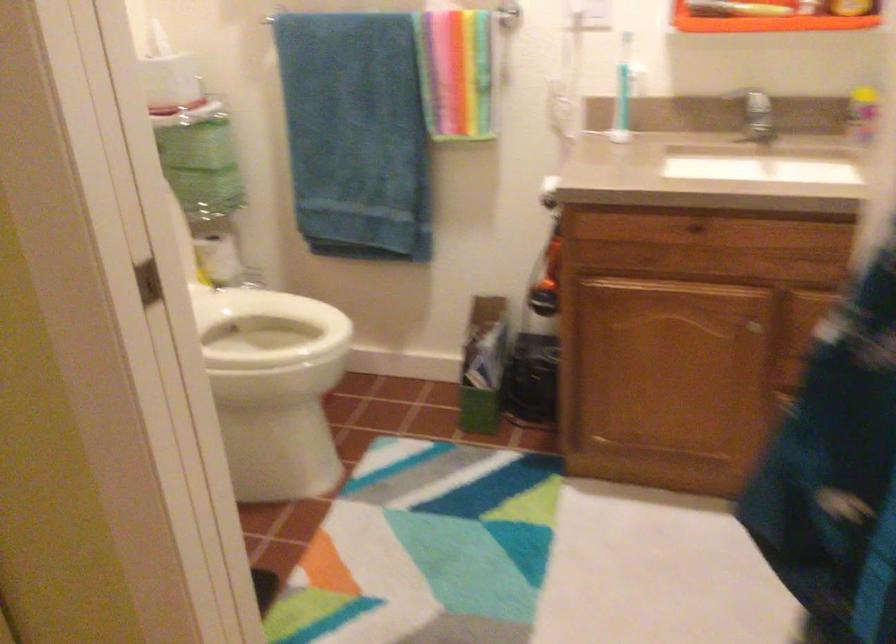
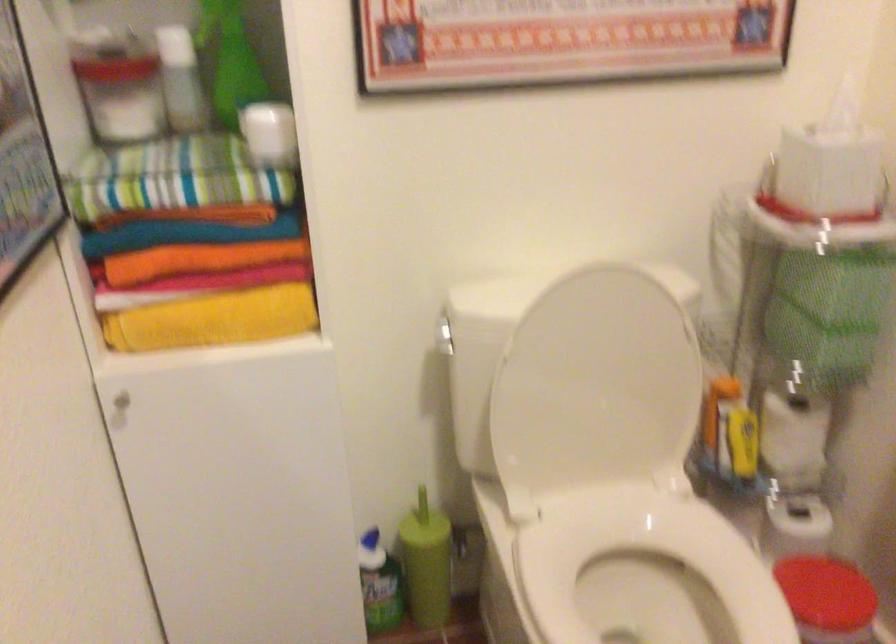
Find the pixel in the second image that matches (x=192, y=272) in the first image.

(743, 440)